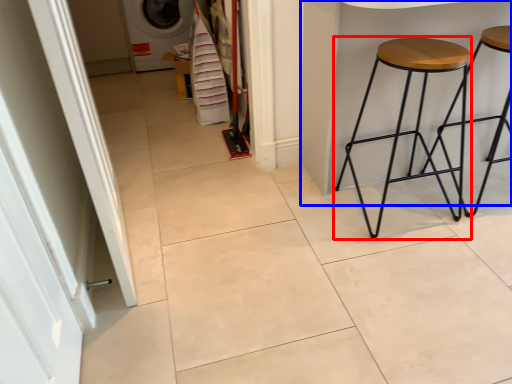
Question: Among these objects, which one is nearest to the camera, stool (highlighted by a red box) or table (highlighted by a blue box)?

Choices:
 (A) stool
 (B) table

Answer: (B)